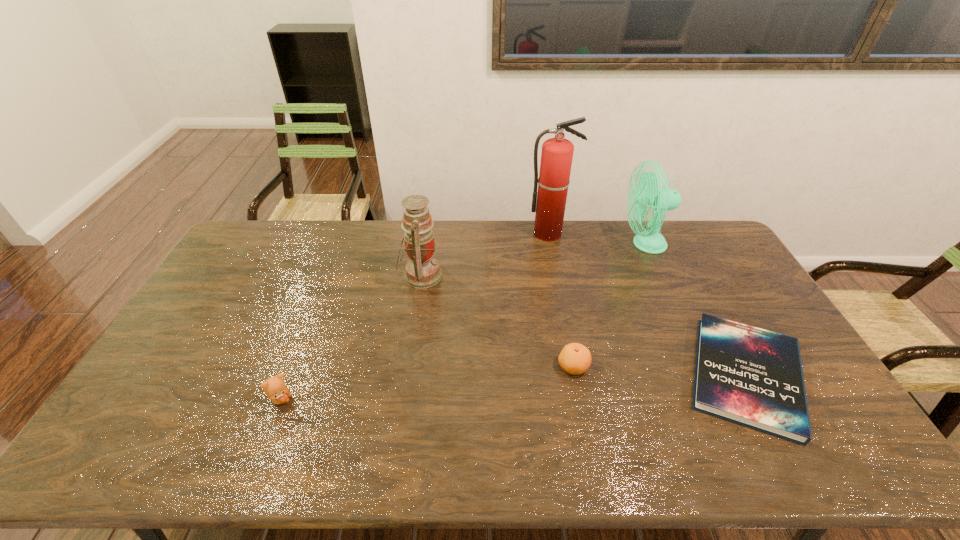
At what (x,y) coordinates should I click in order to perform the action: click on free space located 0.250m in front of the fan to blow air. Please return your answer as a coordinate pair (x, y). Image resolution: width=960 pixels, height=540 pixels. Looking at the image, I should click on (557, 244).

Identify the location of free space located on the right of the second object from left to right. This screenshot has width=960, height=540. (457, 275).

Locate an element on the screen. vacant space located on the face of the teddy bear is located at coordinates (363, 400).

Identify the location of vacant area situated 0.100m on the right of the fifth tallest object. Image resolution: width=960 pixels, height=540 pixels. (625, 367).

You are a GUI agent. You are given a task and a screenshot of the screen. Output one action in this format:
    pyautogui.click(x=<x>, y=<y>)
    Task: Click on the vacant space situated 0.320m on the back of the hardback book
    
    Given the screenshot: What is the action you would take?
    pyautogui.click(x=682, y=255)

Locate an element on the screen. The image size is (960, 540). fire extinguisher that is at the far edge is located at coordinates (557, 153).

Locate an element on the screen. The image size is (960, 540). fan located in the far edge section of the desktop is located at coordinates (648, 192).

The image size is (960, 540). What are the coordinates of `oil lamp that is at the far edge` in the screenshot? It's located at (422, 270).

Where is `object that is at the near edge`? This screenshot has height=540, width=960. object that is at the near edge is located at coordinates (750, 376).

The width and height of the screenshot is (960, 540). Identify the location of object situated at the right edge. (750, 376).